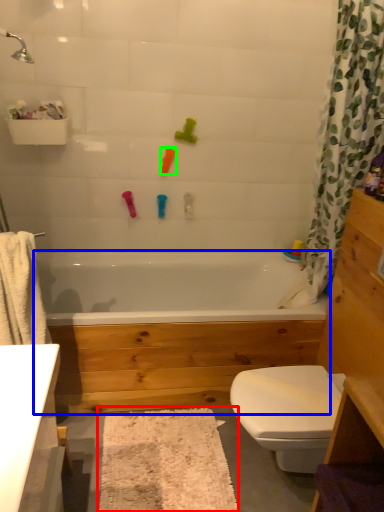
Question: Which is farther away from bath mat (highlighted by a red box)? bathtub (highlighted by a blue box) or toy (highlighted by a green box)?

Choices:
 (A) bathtub
 (B) toy

Answer: (B)